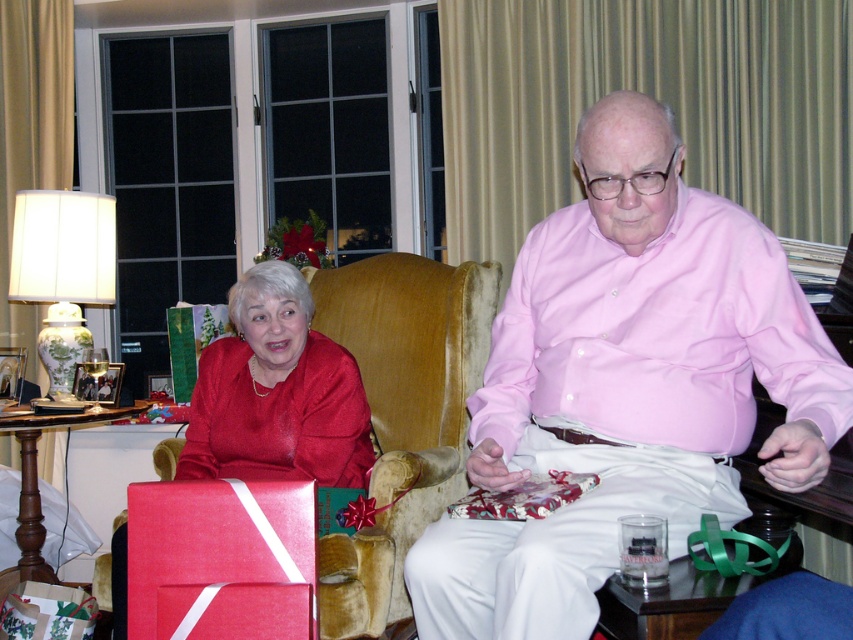
Question: Is pink cotton shirt at center thinner than satin red dress at lower left?

Choices:
 (A) yes
 (B) no

Answer: (B)

Question: Which point appears closest to the camera in this image?

Choices:
 (A) (252, 408)
 (B) (643, 128)

Answer: (B)

Question: Does pink cotton shirt at center appear on the left side of satin red dress at lower left?

Choices:
 (A) yes
 (B) no

Answer: (B)

Question: Which object is closer to the camera taking this photo?

Choices:
 (A) pink cotton shirt at center
 (B) satin red dress at lower left

Answer: (A)

Question: Is pink cotton shirt at center to the right of satin red dress at lower left from the viewer's perspective?

Choices:
 (A) yes
 (B) no

Answer: (A)

Question: Which object is farther from the camera taking this photo?

Choices:
 (A) satin red dress at lower left
 (B) pink cotton shirt at center

Answer: (A)